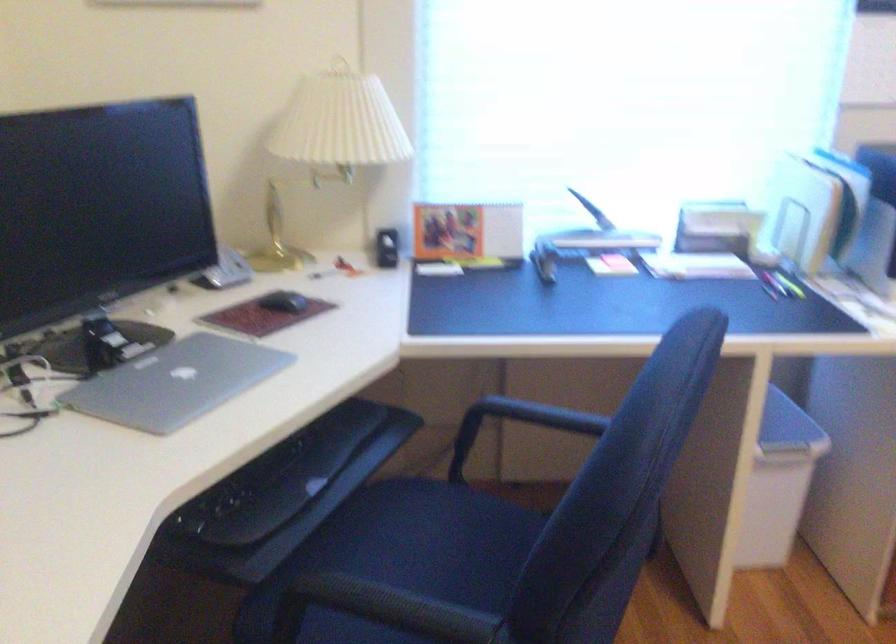
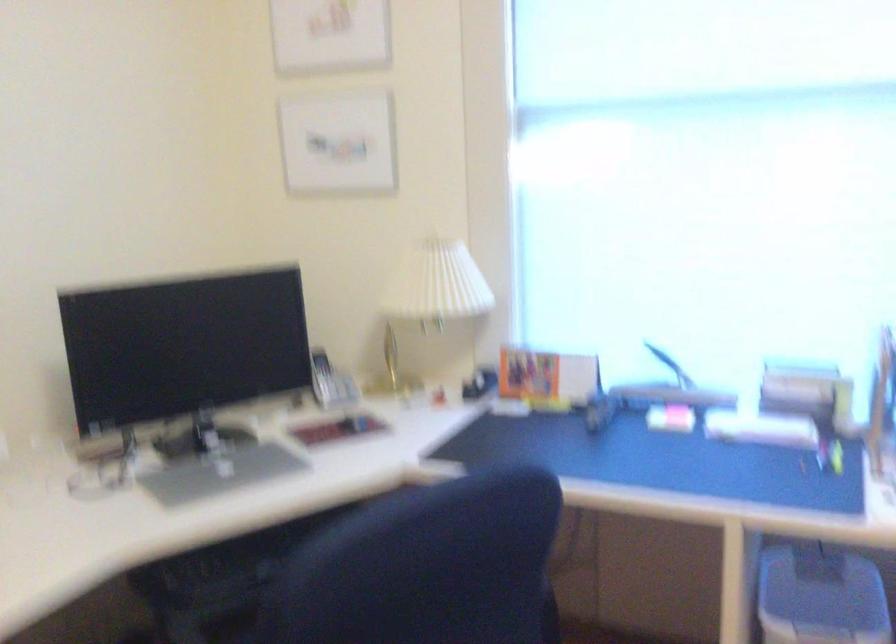
In the second image, find the point that corresponds to (x=213, y=257) in the first image.

(330, 382)